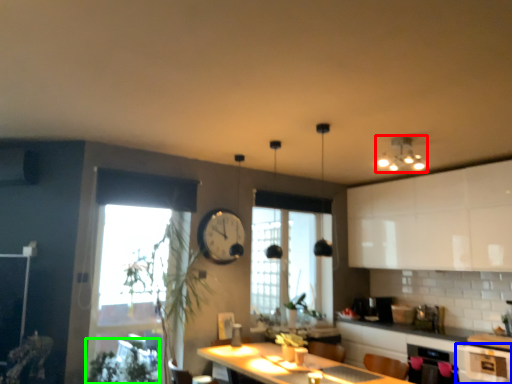
Question: Estimate the real-world distances between objects in this image. Which object is closer to light fixture (highlighted by a red box), cabinetry (highlighted by a blue box) or plant (highlighted by a green box)?

Choices:
 (A) cabinetry
 (B) plant

Answer: (A)